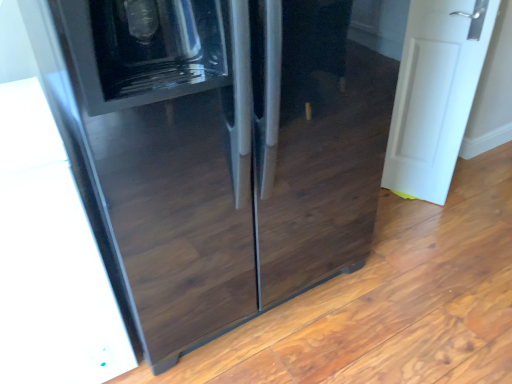
Identify the location of white matte door at right. (435, 94).

The image size is (512, 384). Describe the element at coordinates (435, 94) in the screenshot. I see `white matte door at right` at that location.

What are the coordinates of `glossy black refrigerator at center` in the screenshot? It's located at (221, 149).

Describe the element at coordinates (221, 149) in the screenshot. This screenshot has width=512, height=384. I see `glossy black refrigerator at center` at that location.

Measure the distance between glossy black refrigerator at center and camera.

glossy black refrigerator at center and camera are 28.06 inches apart from each other.

Measure the distance between point (282, 35) and camera.

A distance of 95.20 centimeters exists between point (282, 35) and camera.

Find the location of a particular element. Image resolution: width=512 pixels, height=384 pixels. white matte door at right is located at coordinates (435, 94).

Considering the relative positions of white matte door at right and glossy black refrigerator at center in the image provided, is white matte door at right to the right of glossy black refrigerator at center from the viewer's perspective?

Correct, you'll find white matte door at right to the right of glossy black refrigerator at center.

Which object is more forward, white matte door at right or glossy black refrigerator at center?

glossy black refrigerator at center is more forward.

Is point (442, 168) more distant than point (267, 155)?

Yes, point (442, 168) is behind point (267, 155).

From the image's perspective, does white matte door at right appear higher than glossy black refrigerator at center?

Yes, from the image's perspective, white matte door at right is above glossy black refrigerator at center.

From a real-world perspective, who is located higher, white matte door at right or glossy black refrigerator at center?

glossy black refrigerator at center.

Is white matte door at right wider than glossy black refrigerator at center?

In fact, white matte door at right might be narrower than glossy black refrigerator at center.

Considering the sizes of objects white matte door at right and glossy black refrigerator at center in the image provided, who is shorter, white matte door at right or glossy black refrigerator at center?

Standing shorter between the two is white matte door at right.

Between white matte door at right and glossy black refrigerator at center, which one has larger size?

glossy black refrigerator at center.

Is white matte door at right inside or outside of glossy black refrigerator at center?

white matte door at right lies outside glossy black refrigerator at center.

Is white matte door at right not close to glossy black refrigerator at center?

No, white matte door at right is not far away from glossy black refrigerator at center.

Is white matte door at right oriented towards glossy black refrigerator at center?

No, white matte door at right is not facing towards glossy black refrigerator at center.

What's the angular difference between white matte door at right and glossy black refrigerator at center's facing directions?

116 degrees.

The image size is (512, 384). In order to click on refrigerator above the white matte door at right (from a real-world perspective) in this screenshot , I will do `click(221, 149)`.

From the picture: Visually, is glossy black refrigerator at center positioned to the left or to the right of white matte door at right?

glossy black refrigerator at center is to the left of white matte door at right.

Relative to white matte door at right, is glossy black refrigerator at center in front or behind?

glossy black refrigerator at center is in front of white matte door at right.

Which point is more forward, (184, 313) or (414, 153)?

Positioned in front is point (184, 313).

From the image's perspective, which object appears higher, glossy black refrigerator at center or white matte door at right?

white matte door at right.

From a real-world perspective, is glossy black refrigerator at center on white matte door at right?

Yes, from a real-world perspective, glossy black refrigerator at center is over white matte door at right

Considering the sizes of objects glossy black refrigerator at center and white matte door at right in the image provided, who is thinner, glossy black refrigerator at center or white matte door at right?

white matte door at right.

Can you confirm if glossy black refrigerator at center is shorter than white matte door at right?

No.

Looking at the image, does glossy black refrigerator at center seem bigger or smaller compared to white matte door at right?

Clearly, glossy black refrigerator at center is larger in size than white matte door at right.

Is glossy black refrigerator at center completely or partially outside of white matte door at right?

Yes, glossy black refrigerator at center is located beyond the bounds of white matte door at right.

Are glossy black refrigerator at center and white matte door at right located far from each other?

They are positioned close to each other.

Does glossy black refrigerator at center turn towards white matte door at right?

No.

From the picture: How many degrees apart are the facing directions of glossy black refrigerator at center and white matte door at right?

There is a 116-degree angle between the facing directions of glossy black refrigerator at center and white matte door at right.

Find the location of `refrigerator above the white matte door at right (from a real-world perspective)`. refrigerator above the white matte door at right (from a real-world perspective) is located at coordinates (221, 149).

Where is `door behind the glossy black refrigerator at center`? The width and height of the screenshot is (512, 384). door behind the glossy black refrigerator at center is located at coordinates (435, 94).

You are a GUI agent. You are given a task and a screenshot of the screen. Output one action in this format:
    pyautogui.click(x=<x>, y=<y>)
    Task: Click on the refrigerator above the white matte door at right (from a real-world perspective)
    
    Given the screenshot: What is the action you would take?
    pyautogui.click(x=221, y=149)